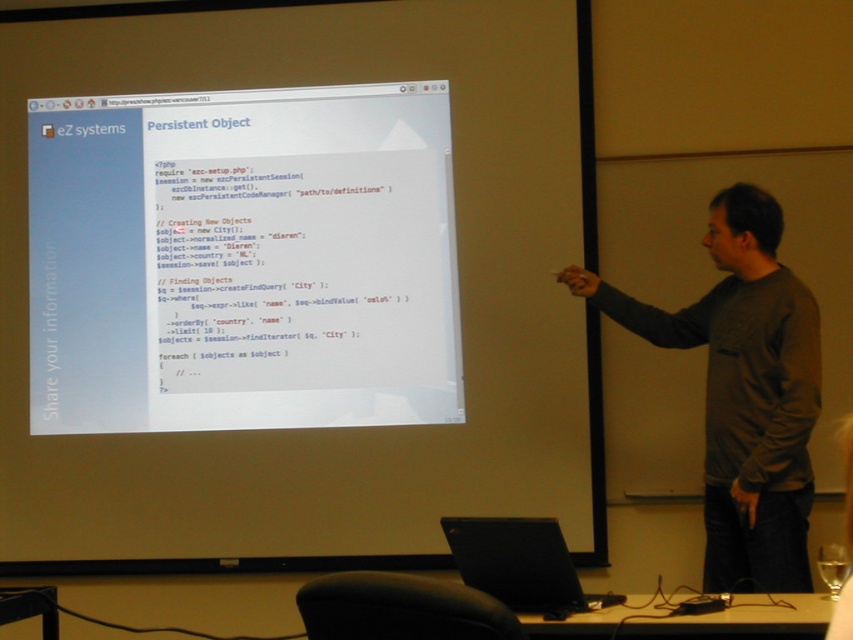
Is point (390, 323) farther from camera compared to point (543, 564)?

That is True.

Who is more distant from viewer, (44,168) or (572,611)?

The point (44,168) is behind.

Locate an element on the screen. The width and height of the screenshot is (853, 640). white glossy projector screen at upper center is located at coordinates (242, 260).

Does white glossy projector screen at upper center have a greater height compared to gray cotton shirt at right?

Yes, white glossy projector screen at upper center is taller than gray cotton shirt at right.

Is white glossy projector screen at upper center thinner than gray cotton shirt at right?

Incorrect, white glossy projector screen at upper center's width is not less than gray cotton shirt at right's.

Does point (61, 144) come behind point (785, 588)?

Yes, it is behind point (785, 588).

Identify the location of white glossy projector screen at upper center. (242, 260).

Who is positioned more to the left, white glossy projector screen at upper center or clear glass at lower right?

white glossy projector screen at upper center is more to the left.

Is white glossy projector screen at upper center in front of clear glass at lower right?

No.

Is point (396, 193) closer to camera compared to point (817, 552)?

That is False.

Locate an element on the screen. This screenshot has width=853, height=640. white glossy projector screen at upper center is located at coordinates (242, 260).